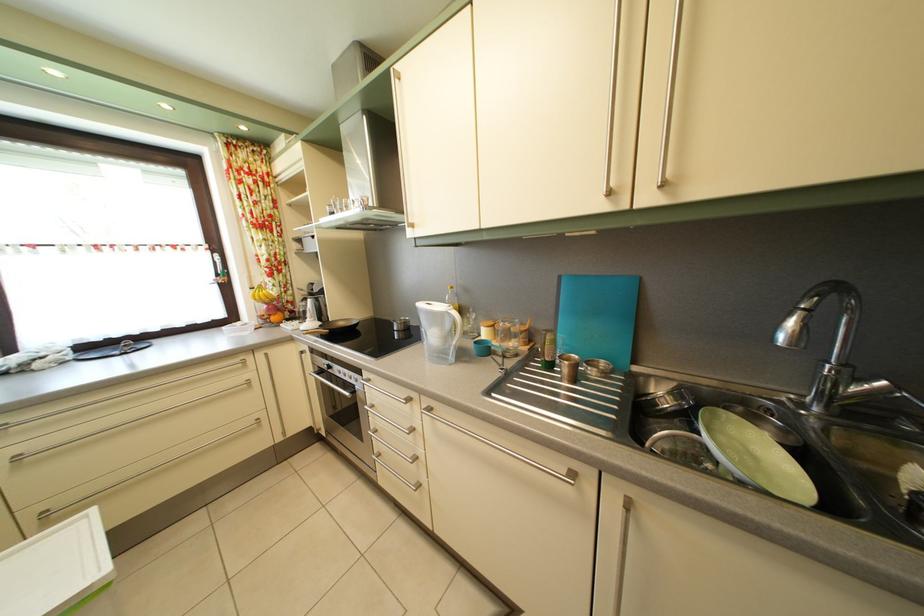
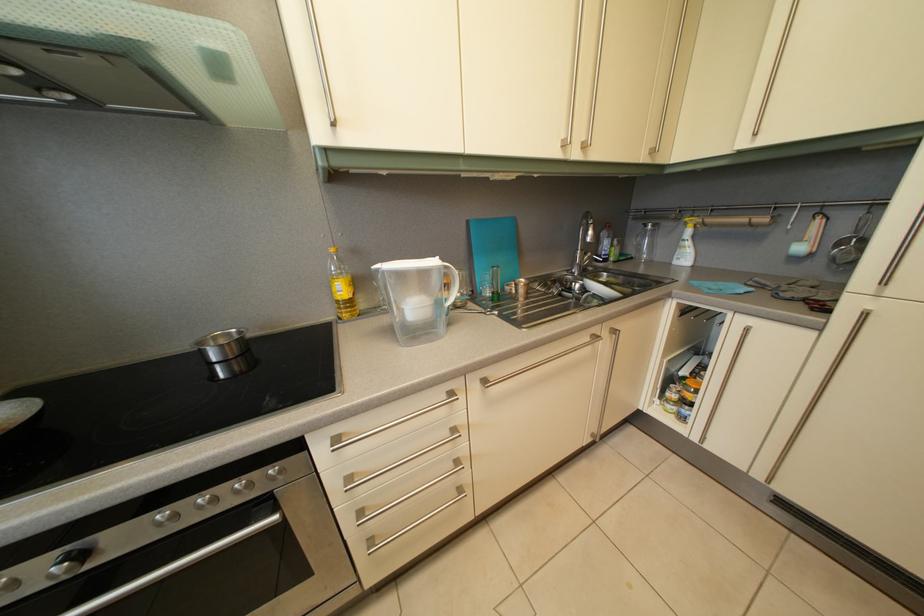
Where in the second image is the point corresponding to [408,328] from the first image?

(224, 346)